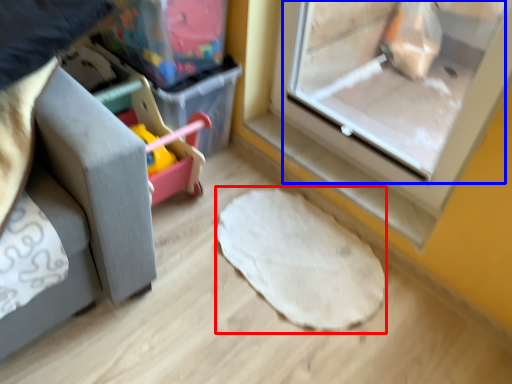
Question: Which object appears farthest to the camera in this image, mat (highlighted by a red box) or screen door (highlighted by a blue box)?

Choices:
 (A) mat
 (B) screen door

Answer: (A)